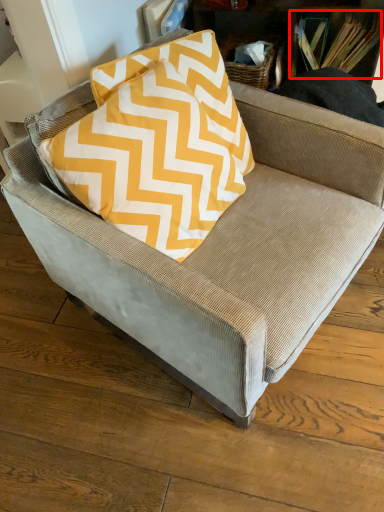
Question: From the image's perspective, where is book (annotated by the red box) located relative to pillow?

Choices:
 (A) below
 (B) above

Answer: (B)